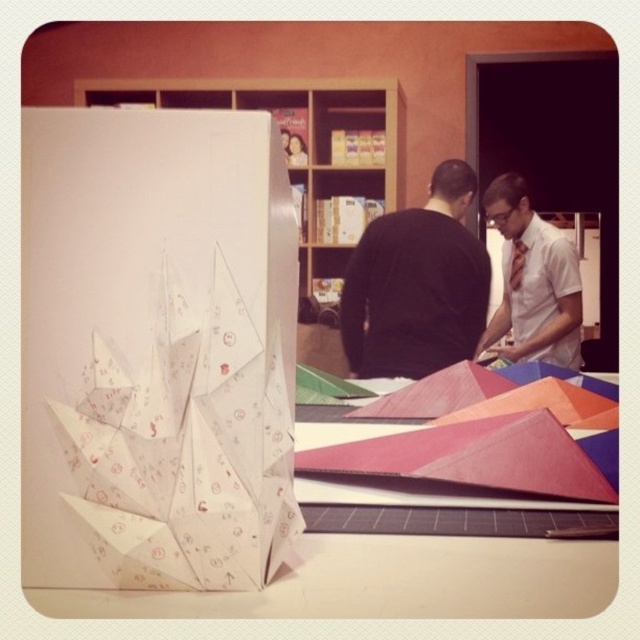
Looking at this image, you are organizing a craft fair and need to place both the white paper table at center and the matte white shirt at center on a display shelf. Which object should you place first to ensure they both fit on the shelf?

The white paper table at center has a lesser width compared to the matte white shirt at center, so you should place the matte white shirt at center first to ensure there is enough space for both items on the shelf.